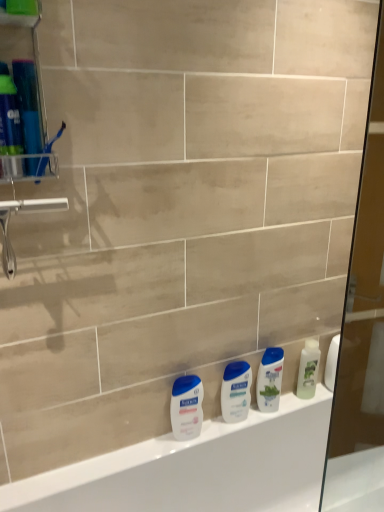
Question: Is clear plastic toothbrush holder at left smaller than white glossy lotion at lower center, which is counted as the 1th toiletry, starting from the left?

Choices:
 (A) yes
 (B) no

Answer: (B)

Question: Does clear plastic toothbrush holder at left have a greater width compared to white glossy lotion at lower center, positioned as the 2th toiletry in right-to-left order?

Choices:
 (A) yes
 (B) no

Answer: (A)

Question: From a real-world perspective, is clear plastic toothbrush holder at left on top of white glossy lotion at lower center, positioned as the 2th toiletry in right-to-left order?

Choices:
 (A) no
 (B) yes

Answer: (B)

Question: Are clear plastic toothbrush holder at left and white glossy lotion at lower center, which is counted as the 1th toiletry, starting from the left, far apart?

Choices:
 (A) yes
 (B) no

Answer: (B)

Question: From the image's perspective, is clear plastic toothbrush holder at left on top of white glossy lotion at lower center, positioned as the 2th toiletry in right-to-left order?

Choices:
 (A) yes
 (B) no

Answer: (A)

Question: Would you say white glossy bathtub at lower center is inside or outside white glossy lotion at center, the 2th toiletry in the left-to-right sequence?

Choices:
 (A) outside
 (B) inside

Answer: (A)

Question: From a real-world perspective, relative to white glossy lotion at center, the 2th toiletry in the left-to-right sequence, is white glossy bathtub at lower center vertically above or below?

Choices:
 (A) above
 (B) below

Answer: (B)

Question: In terms of width, does white glossy bathtub at lower center look wider or thinner when compared to white glossy lotion at center, acting as the first toiletry starting from the right?

Choices:
 (A) wide
 (B) thin

Answer: (A)

Question: Considering their positions, is white glossy bathtub at lower center located in front of or behind white glossy lotion at center, acting as the first toiletry starting from the right?

Choices:
 (A) behind
 (B) front

Answer: (B)

Question: Is white glossy lotion at lower center, which is counted as the 1th toiletry, starting from the left, to the left or to the right of white glossy shampoo at center, acting as the 1th cleaning product starting from the left, in the image?

Choices:
 (A) left
 (B) right

Answer: (A)

Question: From their relative heights in the image, would you say white glossy lotion at lower center, which is counted as the 1th toiletry, starting from the left, is taller or shorter than white glossy shampoo at center, which is the second cleaning product in right-to-left order?

Choices:
 (A) tall
 (B) short

Answer: (B)

Question: From the image's perspective, is white glossy lotion at lower center, positioned as the 2th toiletry in right-to-left order, above or below white glossy shampoo at center, acting as the 1th cleaning product starting from the left?

Choices:
 (A) above
 (B) below

Answer: (B)

Question: Is white glossy lotion at lower center, which is counted as the 1th toiletry, starting from the left, situated inside white glossy shampoo at center, which is the second cleaning product in right-to-left order, or outside?

Choices:
 (A) inside
 (B) outside

Answer: (B)

Question: Considering the positions of white glossy lotion at center, the 2th toiletry in the left-to-right sequence, and white glossy lotion at lower center, which is counted as the 1th toiletry, starting from the left, in the image, is white glossy lotion at center, the 2th toiletry in the left-to-right sequence, bigger or smaller than white glossy lotion at lower center, which is counted as the 1th toiletry, starting from the left,?

Choices:
 (A) big
 (B) small

Answer: (A)

Question: Is white glossy lotion at center, acting as the first toiletry starting from the right, inside the boundaries of white glossy lotion at lower center, positioned as the 2th toiletry in right-to-left order, or outside?

Choices:
 (A) inside
 (B) outside

Answer: (B)